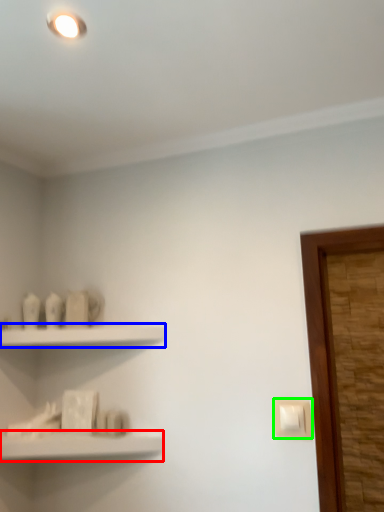
Question: Which object is positioned farthest from shelf (highlighted by a red box)? Select from shelf (highlighted by a blue box) and light switch (highlighted by a green box).

Choices:
 (A) shelf
 (B) light switch

Answer: (B)